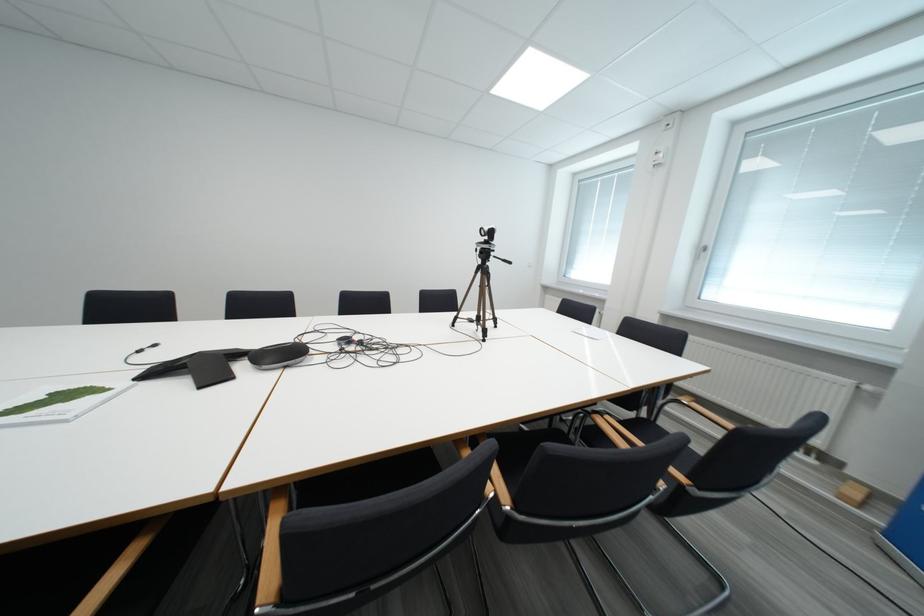
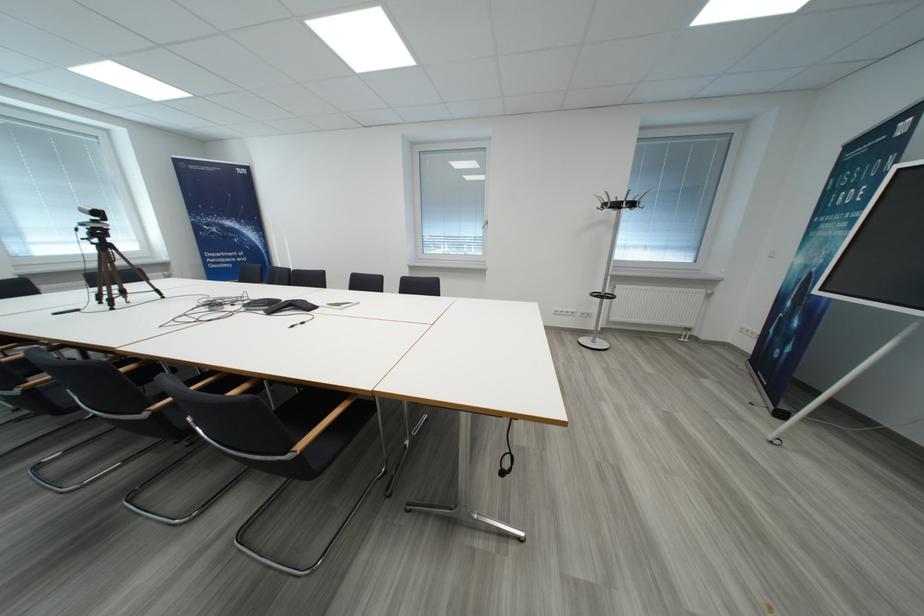
In the second image, find the point that corresponds to the point at 492,257 in the first image.

(106, 236)